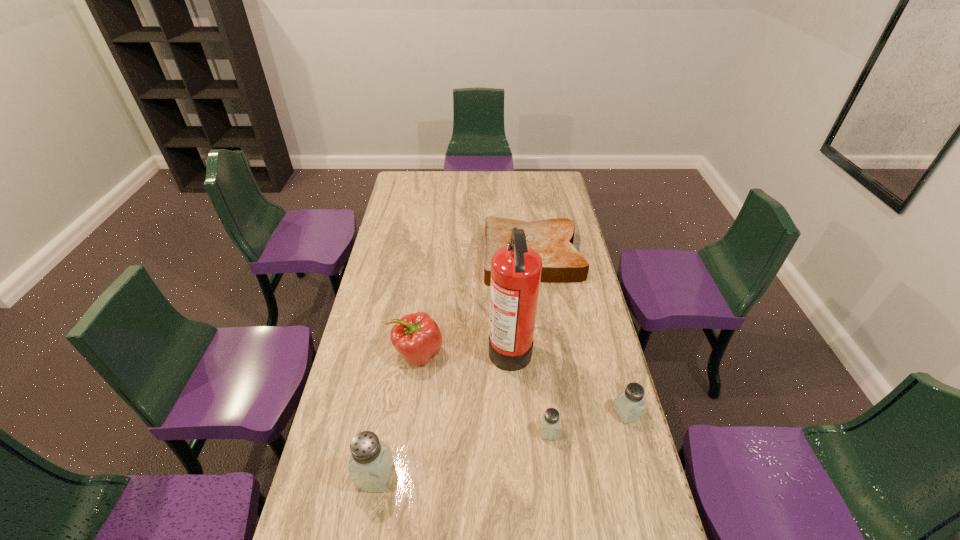
This screenshot has width=960, height=540. I want to click on vacant area located 0.050m on the right of the leftmost saltshaker, so click(411, 475).

Locate an element on the screen. free point located 0.170m on the left of the second shortest object is located at coordinates click(x=483, y=432).

Locate an element on the screen. The image size is (960, 540). vacant space situated 0.240m on the left of the fourth tallest object is located at coordinates (536, 413).

Where is `vacant space located 0.060m on the front-facing side of the fire extinguisher`? Image resolution: width=960 pixels, height=540 pixels. vacant space located 0.060m on the front-facing side of the fire extinguisher is located at coordinates (471, 346).

Identify the location of free space located 0.090m on the front-facing side of the fire extinguisher. The width and height of the screenshot is (960, 540). (463, 346).

The image size is (960, 540). Identify the location of free space located on the front-facing side of the fire extinguisher. (454, 346).

Find the location of a particular element. free point located on the front of the pepper is located at coordinates (403, 458).

The height and width of the screenshot is (540, 960). What are the coordinates of `free space located 0.360m on the back of the bread` in the screenshot? It's located at (523, 191).

Where is `saltshaker that is at the left edge`? This screenshot has width=960, height=540. saltshaker that is at the left edge is located at coordinates (371, 461).

This screenshot has width=960, height=540. Find the location of `pepper at the left edge`. pepper at the left edge is located at coordinates (417, 337).